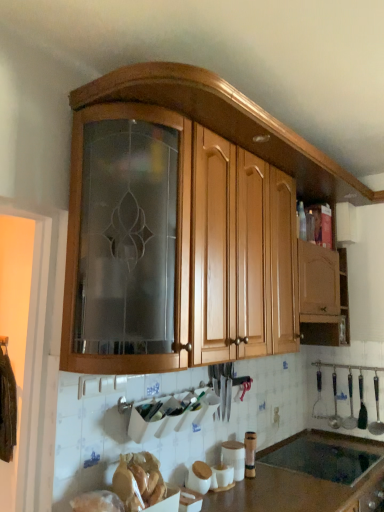
Find the location of a particular element. free space in front of white glossy canister at lower center, the first appliance from the back is located at coordinates (249, 494).